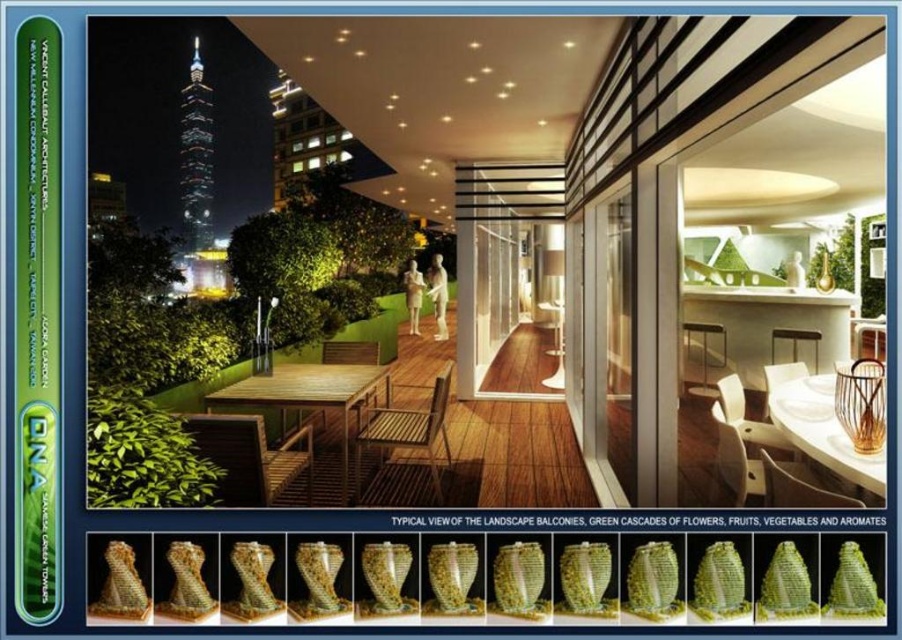
Question: Is wooden table at left positioned behind wooden deck at center?

Choices:
 (A) yes
 (B) no

Answer: (B)

Question: Which point is farther from the camera taking this photo?

Choices:
 (A) (457, 417)
 (B) (575, 403)

Answer: (A)

Question: Does wooden table at left have a greater width compared to wooden deck at center?

Choices:
 (A) no
 (B) yes

Answer: (B)

Question: Can you confirm if wooden table at left is wider than wooden deck at center?

Choices:
 (A) yes
 (B) no

Answer: (A)